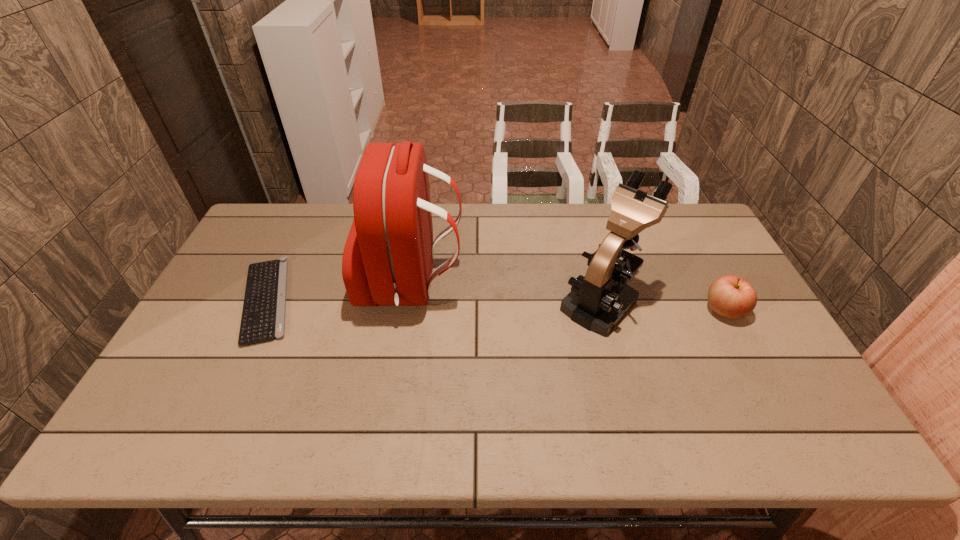
Where is `free space located on the left of the apple`? free space located on the left of the apple is located at coordinates (682, 310).

Where is `vacant position located 0.250m on the front of the computer keyboard`? The height and width of the screenshot is (540, 960). vacant position located 0.250m on the front of the computer keyboard is located at coordinates (200, 440).

The width and height of the screenshot is (960, 540). Identify the location of object located in the left edge section of the desktop. (263, 316).

What are the coordinates of `object that is positioned at the right edge` in the screenshot? It's located at (730, 296).

In the image, there is a desktop. Identify the location of vacant space at the far edge. (471, 207).

I want to click on free space at the near edge of the desktop, so click(436, 441).

In the image, there is a desktop. Where is `vacant area at the left edge`? The image size is (960, 540). vacant area at the left edge is located at coordinates (240, 315).

What are the coordinates of `vacant space at the far left corner of the desktop` in the screenshot? It's located at click(279, 231).

Locate an element on the screen. The width and height of the screenshot is (960, 540). vacant space at the far right corner of the desktop is located at coordinates (690, 246).

The height and width of the screenshot is (540, 960). Find the location of `unoccupied area between the third tallest object and the second object from right to left`. unoccupied area between the third tallest object and the second object from right to left is located at coordinates (662, 306).